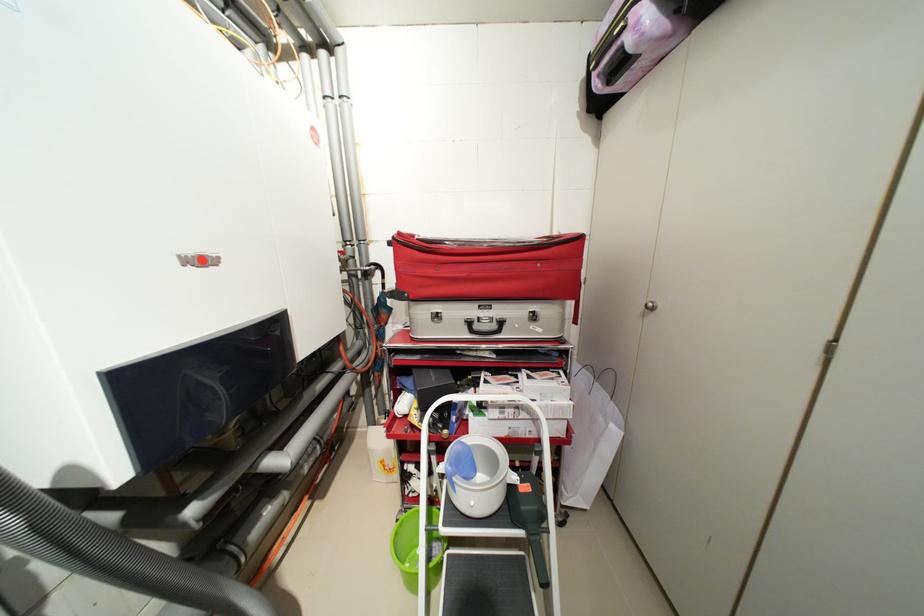
Image resolution: width=924 pixels, height=616 pixels. I want to click on black fabric handle, so click(x=483, y=326).